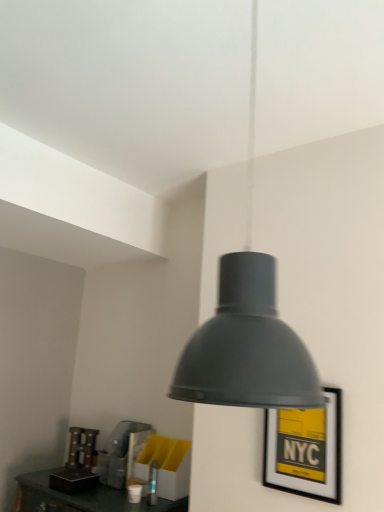
Question: From their relative heights in the image, would you say yellow matte picture frame at center-right is taller or shorter than matte black lampshade at center?

Choices:
 (A) tall
 (B) short

Answer: (B)

Question: Is yellow matte picture frame at center-right wider or thinner than matte black lampshade at center?

Choices:
 (A) thin
 (B) wide

Answer: (A)

Question: From a real-world perspective, relative to matte black lampshade at center, is yellow matte picture frame at center-right vertically above or below?

Choices:
 (A) below
 (B) above

Answer: (A)

Question: From their relative heights in the image, would you say matte black lampshade at center is taller or shorter than yellow matte picture frame at center-right?

Choices:
 (A) tall
 (B) short

Answer: (A)

Question: Is matte black lampshade at center bigger or smaller than yellow matte picture frame at center-right?

Choices:
 (A) big
 (B) small

Answer: (A)

Question: Does point (188, 393) appear closer or farther from the camera than point (271, 484)?

Choices:
 (A) closer
 (B) farther

Answer: (A)

Question: Based on their positions, is matte black lampshade at center located to the left or right of yellow matte picture frame at center-right?

Choices:
 (A) left
 (B) right

Answer: (A)